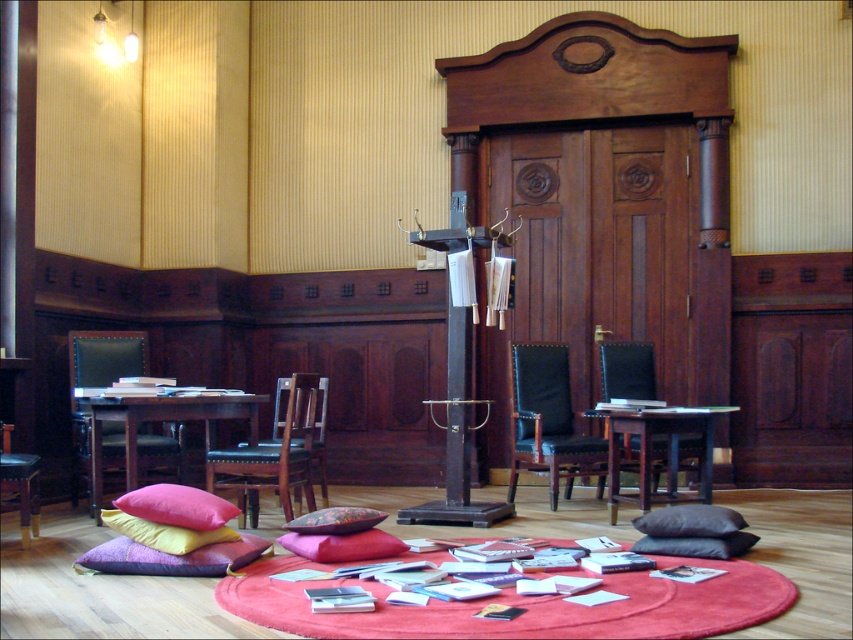
Which is below, black leather armchair at right or leather cushioned chair at center?

leather cushioned chair at center is lower down.

Which is behind, point (706, 461) or point (282, 508)?

Point (282, 508)

Is point (698, 424) less distant than point (241, 497)?

No, it is not.

Find the location of a particular element. Image resolution: width=853 pixels, height=640 pixels. black leather armchair at right is located at coordinates (664, 449).

What do you see at coordinates (171, 557) in the screenshot? This screenshot has height=640, width=853. I see `velvet purple pillow at lower left` at bounding box center [171, 557].

How much distance is there between velvet purple pillow at lower left and black matte pillow at lower center?

velvet purple pillow at lower left and black matte pillow at lower center are 1.78 meters apart.

Does point (91, 560) come behind point (659, 552)?

No, it is not.

The height and width of the screenshot is (640, 853). What are the coordinates of `velvet purple pillow at lower left` in the screenshot? It's located at (171, 557).

Is velvet cushion at center taller than floral fabric cushion at center?

Indeed, velvet cushion at center has a greater height compared to floral fabric cushion at center.

Does velvet cushion at center come in front of floral fabric cushion at center?

Yes, it is in front of floral fabric cushion at center.

Image resolution: width=853 pixels, height=640 pixels. Find the location of `velvet cushion at center`. velvet cushion at center is located at coordinates click(x=341, y=545).

You are a GUI agent. You are given a task and a screenshot of the screen. Output one action in this format:
    pyautogui.click(x=<x>, y=<y>)
    Task: Click on the velvet cushion at center
    This screenshot has height=640, width=853.
    Given the screenshot: What is the action you would take?
    pyautogui.click(x=341, y=545)